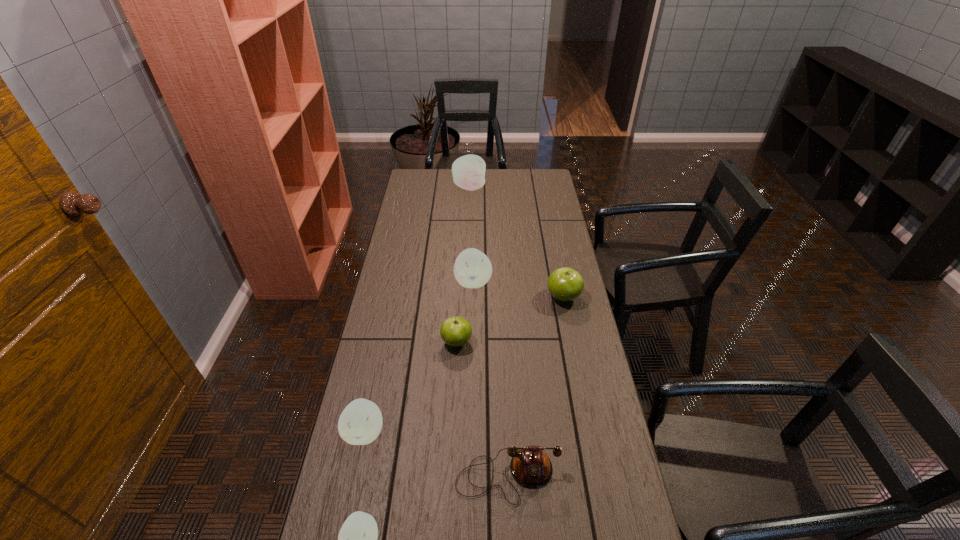
The height and width of the screenshot is (540, 960). In order to click on vacant region located 0.090m on the right of the biggest white apple in this screenshot , I will do `click(503, 187)`.

Find the location of `blank space located on the front of the second farthest white apple`. blank space located on the front of the second farthest white apple is located at coordinates (472, 347).

Find the location of a particular element. The image size is (960, 540). vacant area located on the front of the right green apple is located at coordinates (583, 397).

In order to click on free space located 0.310m on the back of the second nearest white apple in this screenshot , I will do coord(385,335).

Find the location of a particular element. The image size is (960, 540). vacant region located on the back of the fourth farthest apple is located at coordinates (459, 296).

The height and width of the screenshot is (540, 960). What are the coordinates of `free space located 0.070m on the rotary dial of the telephone` in the screenshot? It's located at (510, 536).

What are the coordinates of `object located at the far edge` in the screenshot? It's located at (468, 171).

Identify the location of object that is at the left edge. Image resolution: width=960 pixels, height=540 pixels. (360, 423).

Where is `object that is at the right edge`? This screenshot has width=960, height=540. object that is at the right edge is located at coordinates (565, 284).

Image resolution: width=960 pixels, height=540 pixels. I want to click on free space at the far edge, so click(x=519, y=179).